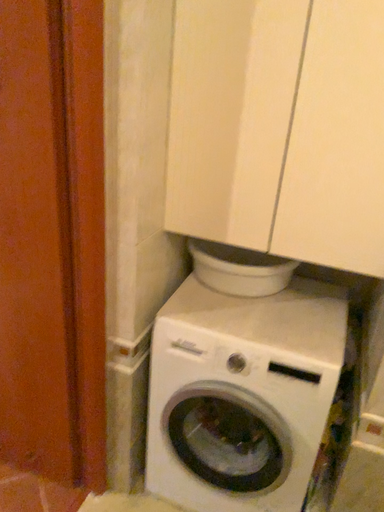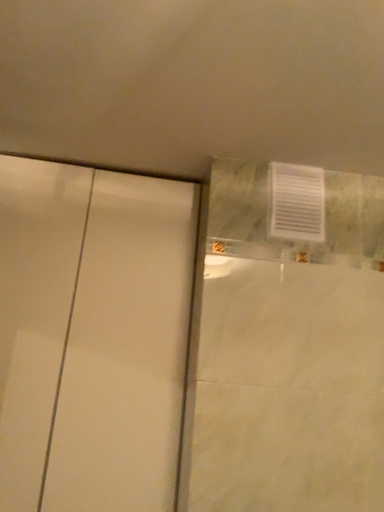
Question: How did the camera likely rotate when shooting the video?

Choices:
 (A) rotated left
 (B) rotated right

Answer: (B)